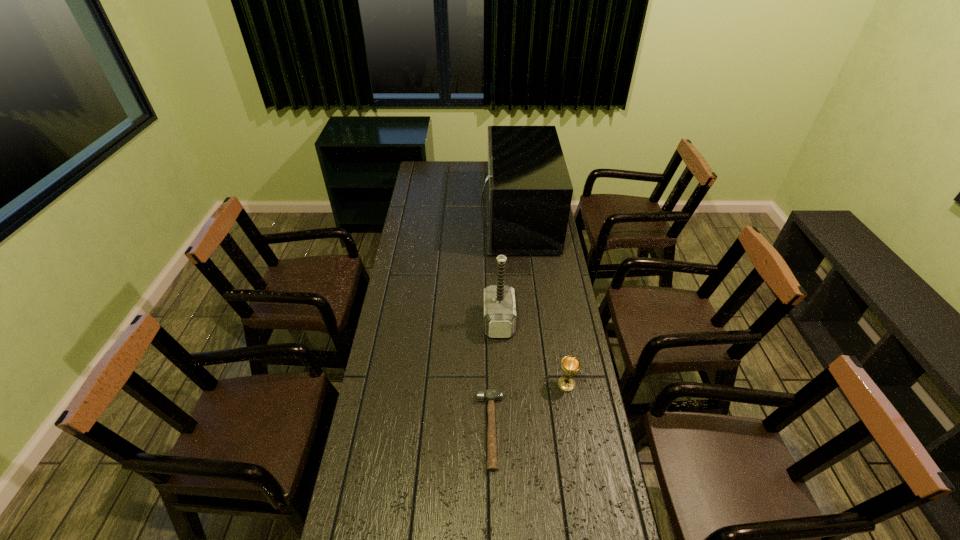
Where is `vacant position located for striking with the head of the second farthest object`? This screenshot has width=960, height=540. vacant position located for striking with the head of the second farthest object is located at coordinates (408, 322).

At what (x,y) coordinates should I click in order to perform the action: click on free space located 0.260m for striking with the head of the second farthest object. Please return your answer as a coordinate pair (x, y). Looking at the image, I should click on (416, 322).

Where is `blank space located on the back of the chalice`? This screenshot has width=960, height=540. blank space located on the back of the chalice is located at coordinates (559, 337).

Where is `vacant point located on the striking face of the shorter hammer`? This screenshot has height=540, width=960. vacant point located on the striking face of the shorter hammer is located at coordinates (419, 430).

Find the location of `vacant space located on the striking face of the shorter hammer`. vacant space located on the striking face of the shorter hammer is located at coordinates (x=367, y=430).

What are the coordinates of `vacant area located 0.120m on the striking face of the shorter hammer` in the screenshot? It's located at (438, 430).

Where is `microwave oven present at the right edge`? microwave oven present at the right edge is located at coordinates coord(528,188).

What are the coordinates of `chalice that is at the right edge` in the screenshot? It's located at click(570, 365).

Image resolution: width=960 pixels, height=540 pixels. In order to click on vacant region at the far edge of the desktop in this screenshot , I will do `click(459, 178)`.

Find the location of a particular element. The width and height of the screenshot is (960, 540). free spot at the left edge of the desktop is located at coordinates (426, 240).